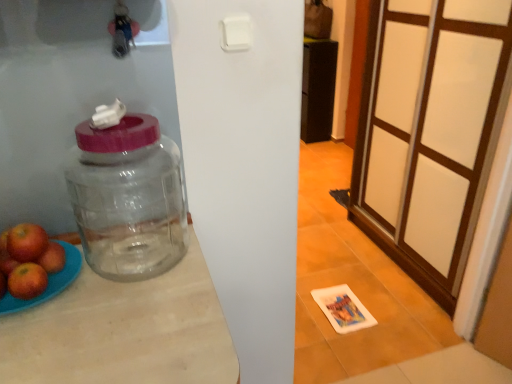
Where is `free spot below transparent glass jar at left (from a real-world perspective)`? The image size is (512, 384). free spot below transparent glass jar at left (from a real-world perspective) is located at coordinates (142, 253).